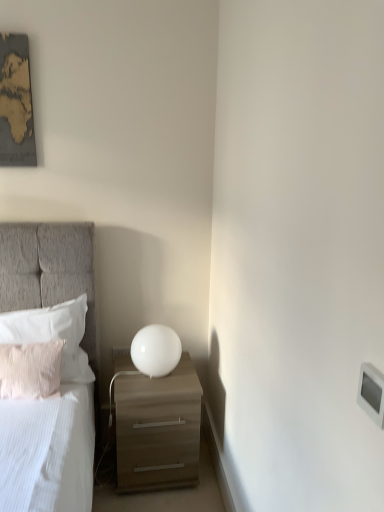
Where is `free spot above matte wood drawer at lower left (from a real-world perspective)`? This screenshot has width=384, height=512. free spot above matte wood drawer at lower left (from a real-world perspective) is located at coordinates (157, 381).